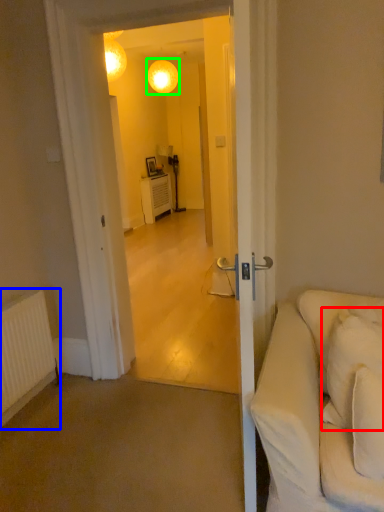
Question: Estimate the real-world distances between objects in this image. Which object is farther from pillow (highlighted by a red box), radiator (highlighted by a blue box) or lamp (highlighted by a green box)?

Choices:
 (A) radiator
 (B) lamp

Answer: (B)